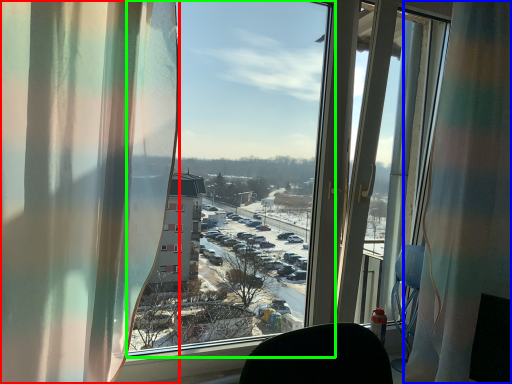
Question: Considering the real-world distances, which object is closest to curtain (highlighted by a red box)? curtain (highlighted by a blue box) or window screen (highlighted by a green box).

Choices:
 (A) curtain
 (B) window screen

Answer: (A)